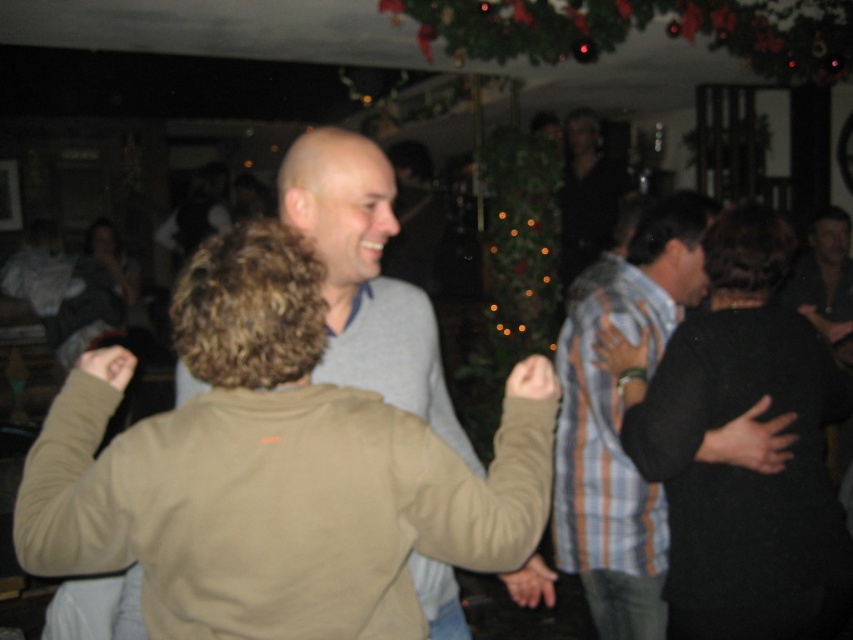
You are a photographer at the party and want to capture a photo of both the black matte dress at center and the gray matte sweater at center in the same frame. The camera has a minimum focus distance of 24 inches. Will you be able to adjust the camera to include both in the shot?

The black matte dress at center and gray matte sweater at center are 23.47 inches apart, which is less than the camera minimum focus distance of 24 inches. Therefore, the photographer can adjust the camera to include both in the shot.

You are standing in the festive room and want to find the gray matte sweater at center. According to the coordinates given, where should you look relative to the room?

The gray matte sweater at center is located at the coordinates point (366, 278), which is near the center of the room.